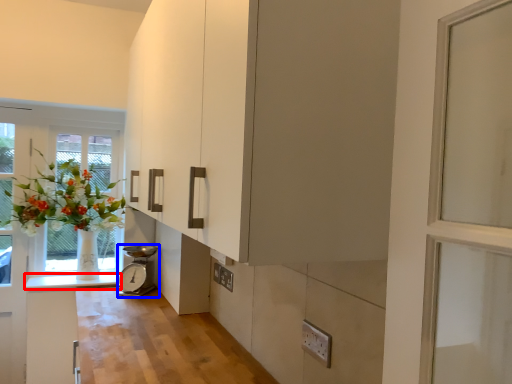
Question: Among these objects, which one is farthest to the camera, counter top (highlighted by a red box) or appliance (highlighted by a blue box)?

Choices:
 (A) counter top
 (B) appliance

Answer: (A)